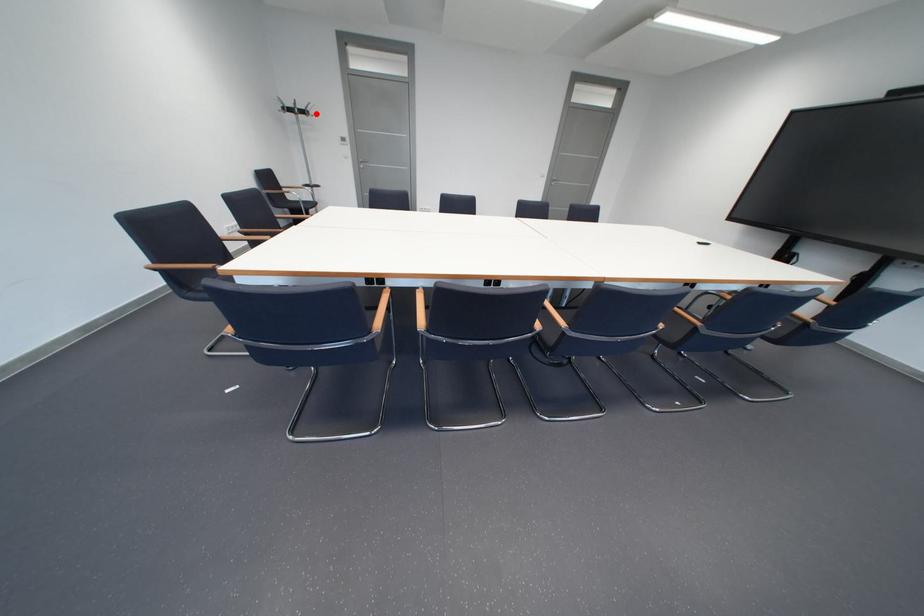
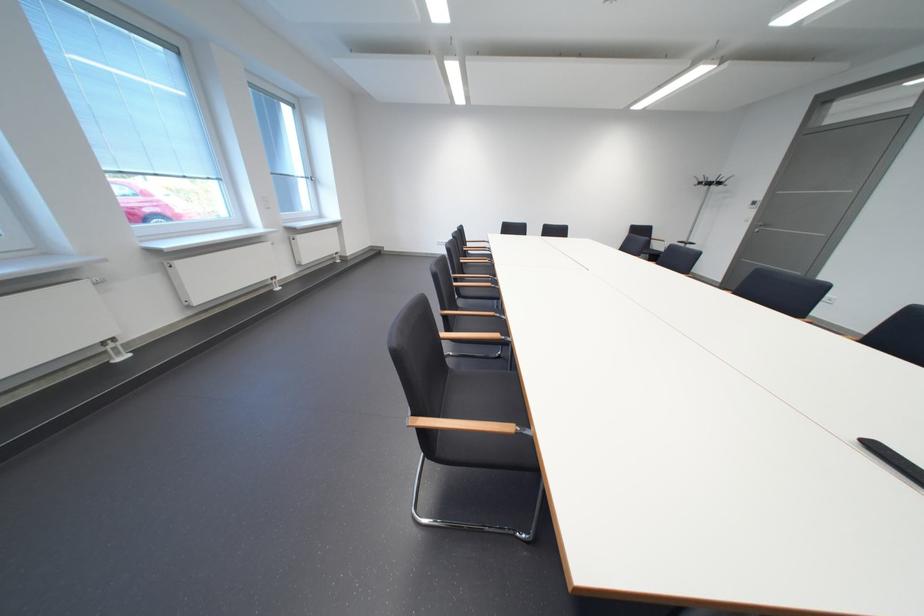
Question: A red point is marked in image1. In image2, is the corresponding 3D point closer to the camera or farther? Reply with the corresponding letter.

Choices:
 (A) The corresponding 3D point is closer.
 (B) The corresponding 3D point is farther.

Answer: (B)